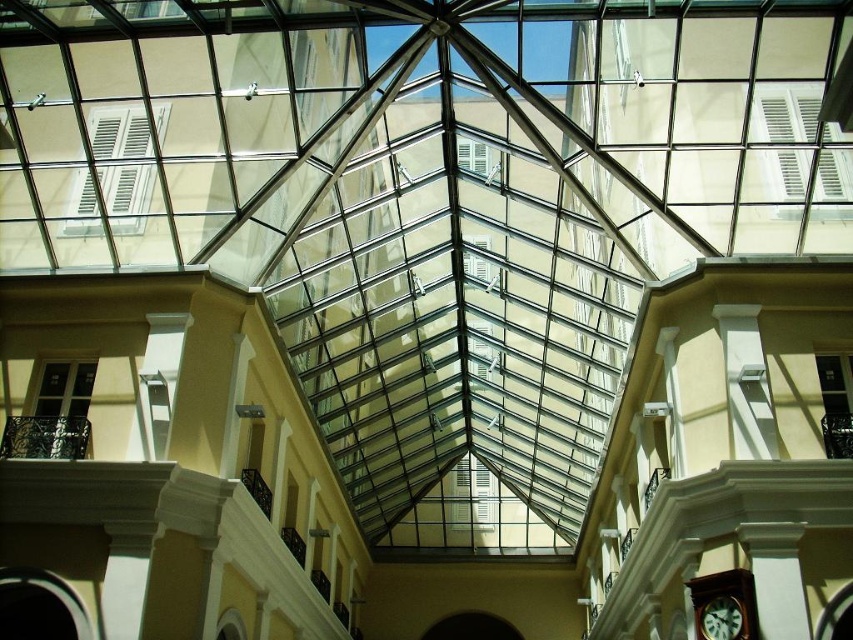
You are standing in the atrium and want to hang a new picture frame that is 1 meter tall between the brown wooden clock at lower right and the green matte clock at lower right. Can the picture frame fit vertically between them based on their heights?

The brown wooden clock at lower right is taller than the green matte clock at lower right. Since the picture frame is 1 meter tall, it depends on the available vertical space between them. However, the description only provides information about their relative heights, not the distance between them. Therefore, we cannot determine if the picture frame will fit vertically based on the given information.